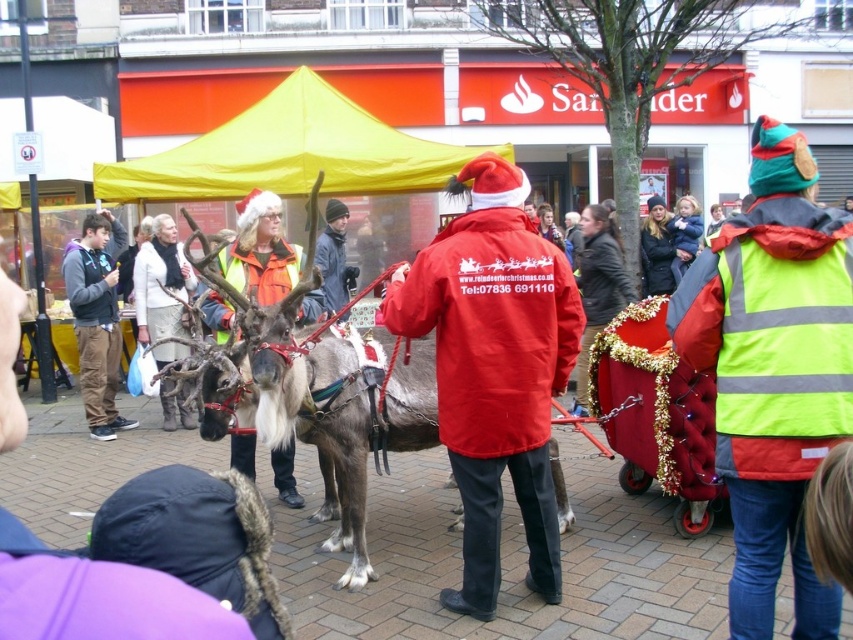
Between yellow fabric canopy at upper center and dark gray fleece jacket at left, which one appears on the left side from the viewer's perspective?

dark gray fleece jacket at left is more to the left.

Can you confirm if yellow fabric canopy at upper center is thinner than dark gray fleece jacket at left?

No, yellow fabric canopy at upper center is not thinner than dark gray fleece jacket at left.

Which is behind, point (354, 141) or point (94, 408)?

Point (354, 141)

What are the coordinates of `yellow fabric canopy at upper center` in the screenshot? It's located at (289, 154).

Which is above, brown fur reindeer at center or dark gray jacket at center?

Positioned higher is dark gray jacket at center.

In the scene shown: Is brown fur reindeer at center positioned before dark gray jacket at center?

Yes, brown fur reindeer at center is closer to the viewer.

Identify the location of brown fur reindeer at center. The height and width of the screenshot is (640, 853). (323, 406).

Between brown fur reindeer at center and dark gray fleece jacket at left, which one is positioned lower?

brown fur reindeer at center

Is brown fur reindeer at center bigger than dark gray fleece jacket at left?

Indeed, brown fur reindeer at center has a larger size compared to dark gray fleece jacket at left.

Who is more forward, (358, 577) or (119, 321)?

Point (358, 577) is in front.

Image resolution: width=853 pixels, height=640 pixels. Find the location of `brown fur reindeer at center`. brown fur reindeer at center is located at coordinates (323, 406).